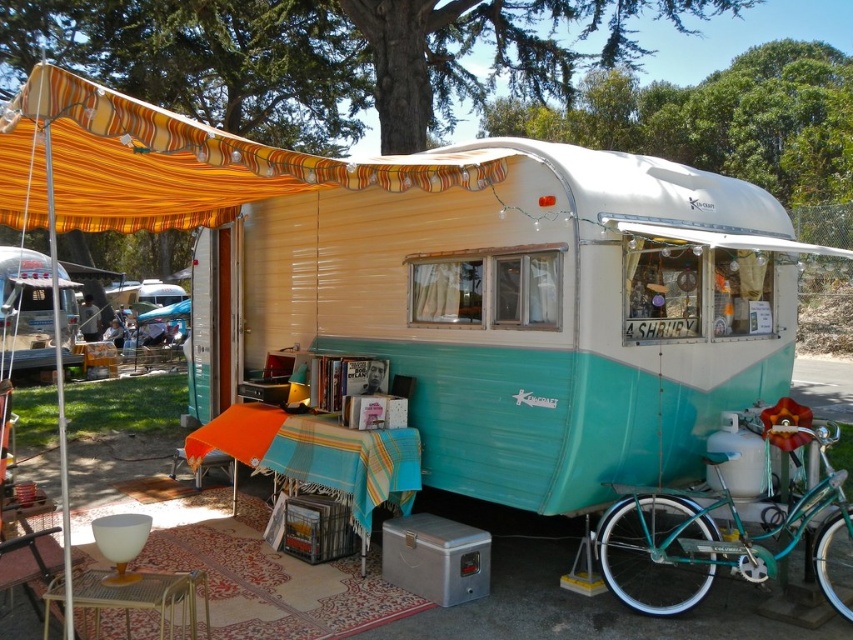
Question: Estimate the real-world distances between objects in this image. Which object is farther from the teal glossy trailer at center?

Choices:
 (A) orange striped fabric canopy at upper left
 (B) teal metallic bicycle at lower right

Answer: (A)

Question: Can you confirm if teal glossy trailer at center is bigger than teal metallic bicycle at lower right?

Choices:
 (A) no
 (B) yes

Answer: (B)

Question: Which object is farther from the camera taking this photo?

Choices:
 (A) teal metallic bicycle at lower right
 (B) teal glossy trailer at center

Answer: (B)

Question: Is teal glossy trailer at center further to the viewer compared to orange striped fabric canopy at upper left?

Choices:
 (A) no
 (B) yes

Answer: (B)

Question: Which is farther from the teal glossy trailer at center?

Choices:
 (A) teal metallic bicycle at lower right
 (B) orange striped fabric canopy at upper left

Answer: (B)

Question: Can you confirm if teal glossy trailer at center is positioned below orange striped fabric canopy at upper left?

Choices:
 (A) no
 (B) yes

Answer: (B)